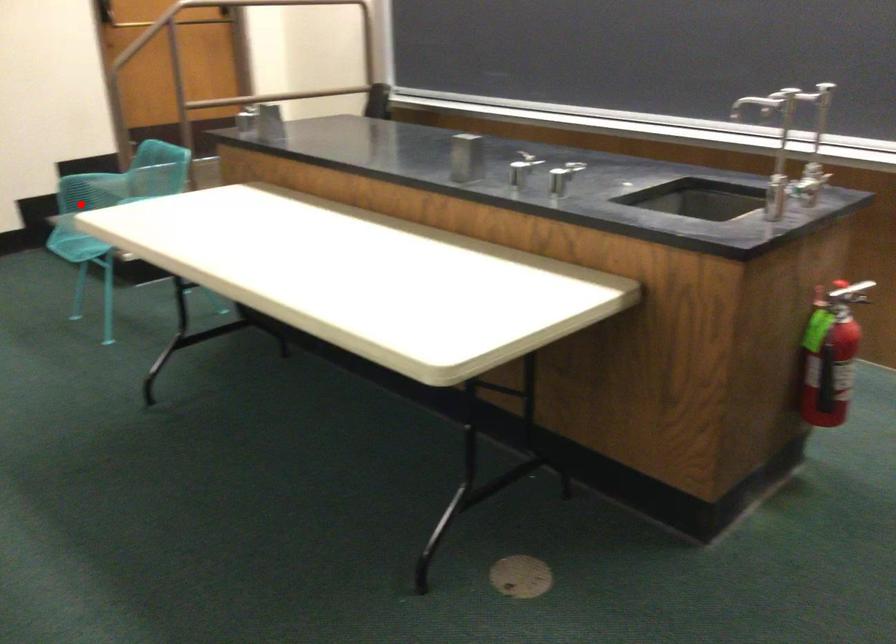
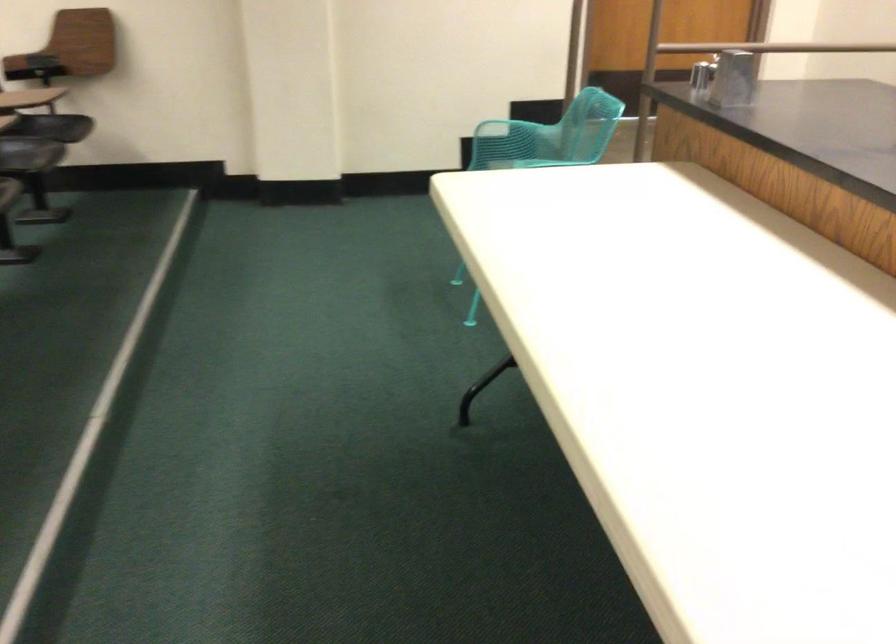
Question: I am providing you with two images of the same scene from different viewpoints. A red point is shown in image1. For the corresponding object point in image2, is it positioned nearer or farther from the camera?

Choices:
 (A) Nearer
 (B) Farther

Answer: (A)